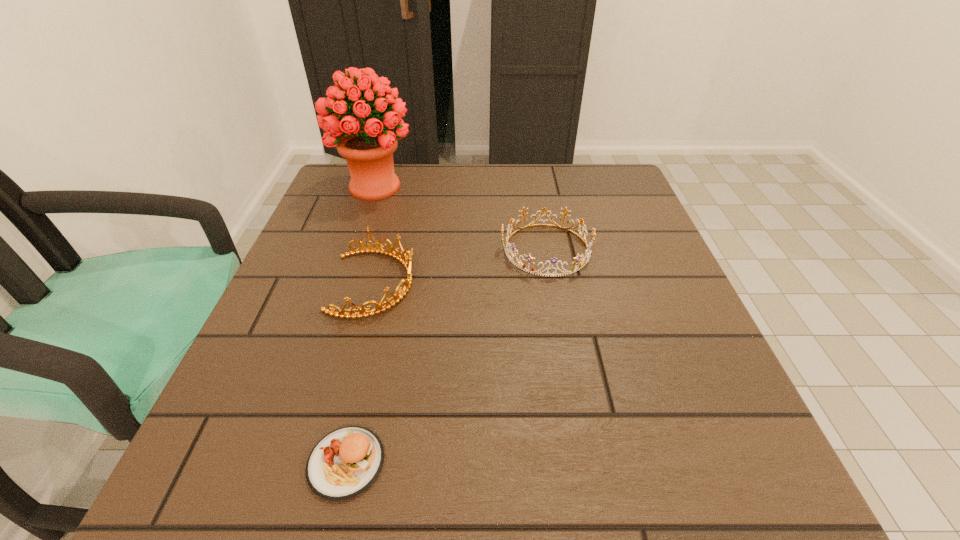
At what (x,y) coordinates should I click in order to perform the action: click on bouquet. Please return your answer as a coordinate pair (x, y). Looking at the image, I should click on (368, 147).

Locate an element on the screen. This screenshot has height=540, width=960. the farthest object is located at coordinates (368, 147).

Locate an element on the screen. This screenshot has height=540, width=960. the taller tiara is located at coordinates (398, 296).

Locate an element on the screen. The height and width of the screenshot is (540, 960). the left tiara is located at coordinates (398, 296).

What are the coordinates of `the rightmost object` in the screenshot? It's located at (510, 227).

At what (x,y) coordinates should I click in order to perform the action: click on the shorter tiara. Please return your answer as a coordinate pair (x, y). This screenshot has height=540, width=960. Looking at the image, I should click on (x=510, y=227).

I want to click on the shortest object, so point(345,462).

Find the location of a particular element. Image resolution: width=960 pixels, height=540 pixels. the nearest object is located at coordinates (345, 462).

Image resolution: width=960 pixels, height=540 pixels. In order to click on vacant space located on the right of the farthest object in this screenshot , I will do `click(500, 187)`.

At what (x,y) coordinates should I click in order to perform the action: click on vacant space situated 0.240m on the front-facing side of the second tallest object. Please return your answer as a coordinate pair (x, y). Looking at the image, I should click on (538, 283).